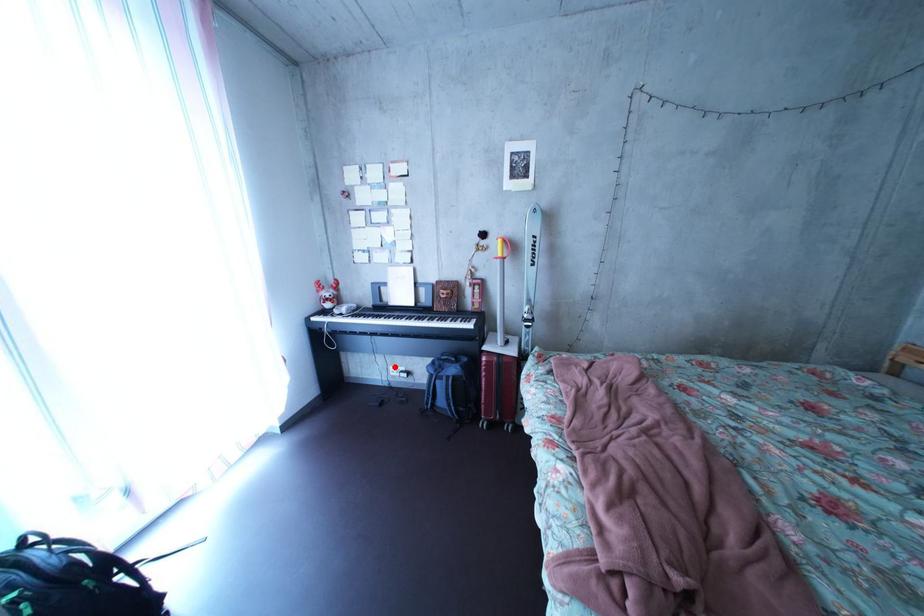
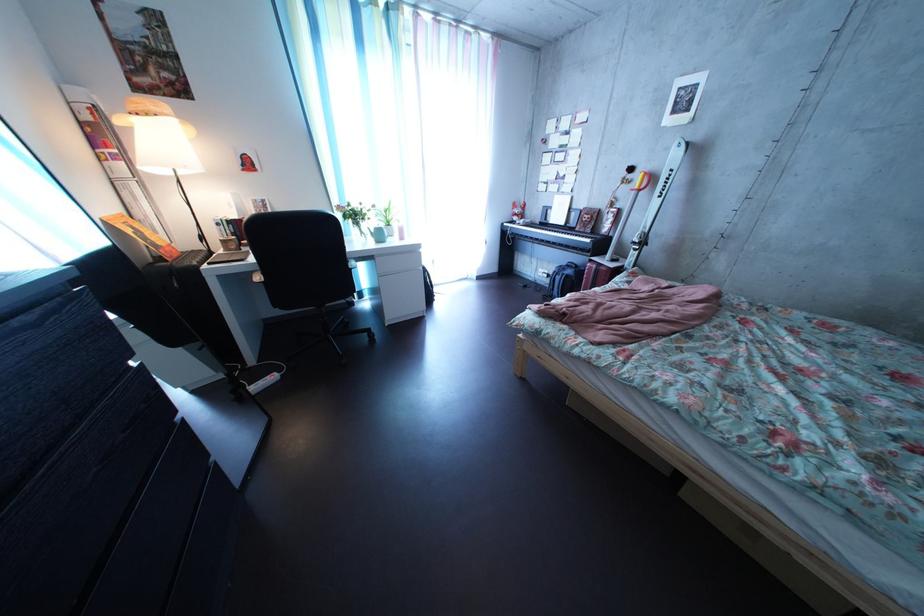
Question: I am providing you with two images of the same scene from different viewpoints. In image1, a red point is highlighted. Considering the same 3D point in image2, which of the following is correct?

Choices:
 (A) It is closer
 (B) It is farther

Answer: (A)